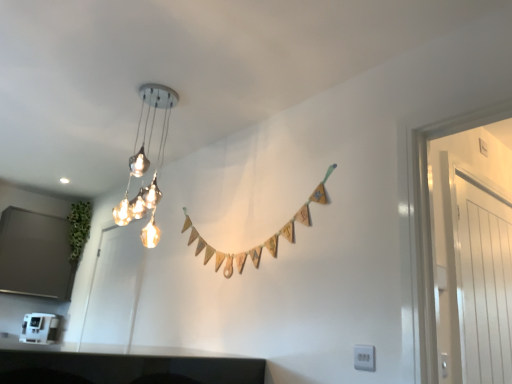
Question: Is white plastic electric outlet at lower right situated inside white plastic coffee machine at lower left or outside?

Choices:
 (A) outside
 (B) inside

Answer: (A)

Question: Considering the positions of white plastic electric outlet at lower right and white plastic coffee machine at lower left in the image, is white plastic electric outlet at lower right taller or shorter than white plastic coffee machine at lower left?

Choices:
 (A) short
 (B) tall

Answer: (A)

Question: Based on their relative distances, which object is farther from the metallic glass chandelier at upper center?

Choices:
 (A) matte white door at left, which appears as the 2th glass door when viewed from the right
 (B) white plastic electric outlet at lower right
 (C) white glossy door at right, which ranks as the 1th glass door in front-to-back order
 (D) white plastic coffee machine at lower left

Answer: (B)

Question: Which is nearer to the metallic glass chandelier at upper center?

Choices:
 (A) white plastic coffee machine at lower left
 (B) matte white door at left, positioned as the second glass door in front-to-back order
 (C) white plastic electric outlet at lower right
 (D) white glossy door at right, which is counted as the first glass door, starting from the right

Answer: (B)